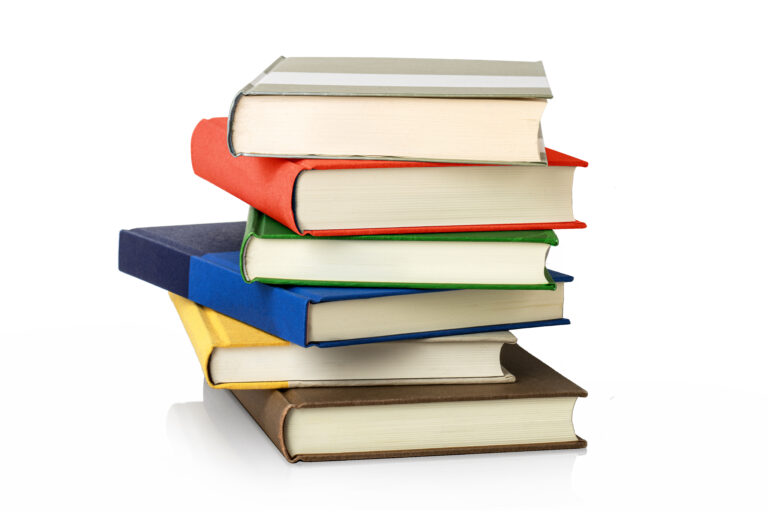
The width and height of the screenshot is (768, 512). I want to click on books, so click(x=378, y=125), click(x=369, y=199), click(x=348, y=271), click(x=353, y=313), click(x=305, y=358), click(x=352, y=435).